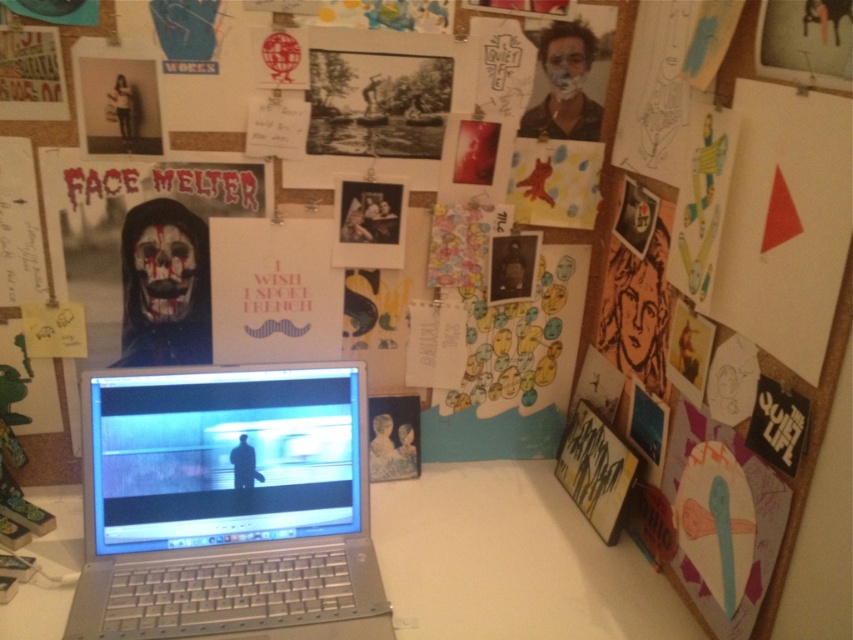
Question: Which of the following is the closest to the observer?

Choices:
 (A) white plastic table at center
 (B) silver metallic laptop at center

Answer: (B)

Question: Does silver metallic laptop at center have a greater width compared to white plastic table at center?

Choices:
 (A) no
 (B) yes

Answer: (A)

Question: Among these points, which one is farthest from the camera?

Choices:
 (A) (555, 556)
 (B) (308, 417)

Answer: (A)

Question: Is silver metallic laptop at center to the left of white plastic table at center from the viewer's perspective?

Choices:
 (A) yes
 (B) no

Answer: (A)

Question: From the image, what is the correct spatial relationship of silver metallic laptop at center in relation to white plastic table at center?

Choices:
 (A) left
 (B) right

Answer: (A)